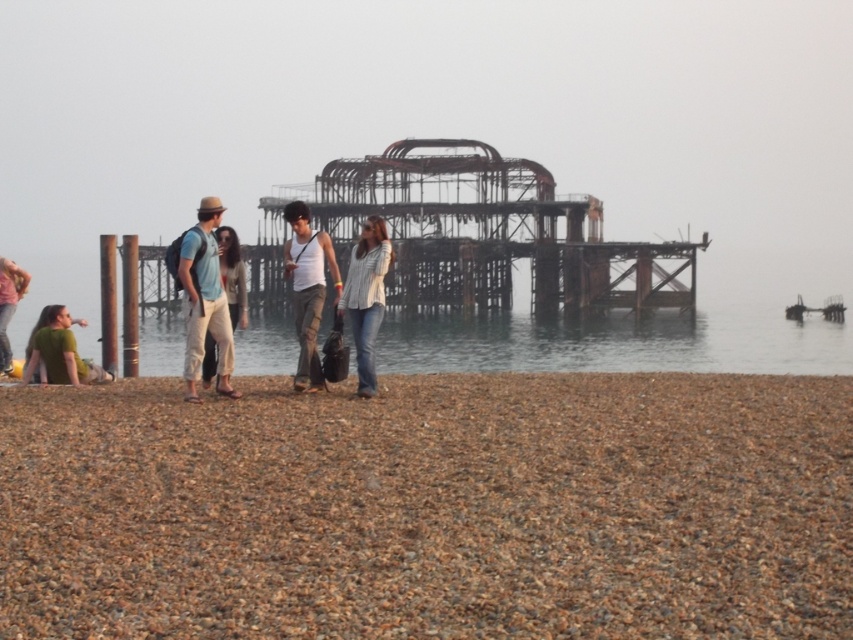
You are standing at the edge of the pebble beach and want to reach the rusty metal pier at center. Based on the coordinates provided in the description, in which general direction should you walk from your current position?

The rusty metal pier at center is located at coordinates point (491, 232), so you should walk towards the center of the beach to reach it.

You are standing at the beach and want to take a photo of the matte white tank top at center without the rusty metal pier at center blocking the view. Which direction should you move to ensure the pier is out of the frame?

The matte white tank top at center is behind the rusty metal pier at center, so you should move forward to get closer to the pier and the tank top, ensuring the pier is no longer between you and the tank top.

You are standing at the edge of the pebble beach and want to place a small flag exactly where the brown gravel at lower center is located. According to the coordinates provided, where should you place the flag?

The flag should be placed at the coordinates point (431,508) where the brown gravel at lower center is located.